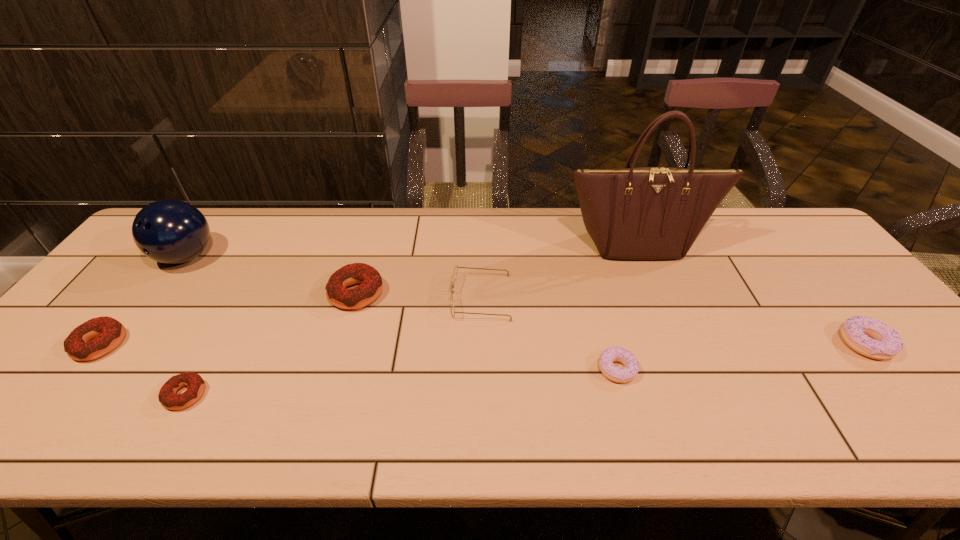
Locate an element on the screen. object at the right edge is located at coordinates pos(857,331).

You are a GUI agent. You are given a task and a screenshot of the screen. Output one action in this format:
    pyautogui.click(x=<x>, y=<y>)
    Task: Click on the object present at the far left corner
    Image resolution: width=960 pixels, height=540 pixels.
    Given the screenshot: What is the action you would take?
    pyautogui.click(x=168, y=231)

Find the location of a particular element. vacant space at the far edge is located at coordinates (571, 217).

Locate an element on the screen. The height and width of the screenshot is (540, 960). free space at the near edge is located at coordinates (655, 436).

You are a GUI agent. You are given a task and a screenshot of the screen. Output one action in this format:
    pyautogui.click(x=<x>, y=<y>)
    Task: Click on the vacant area at the right edge of the desktop
    The image size is (960, 540).
    Given the screenshot: What is the action you would take?
    pyautogui.click(x=804, y=265)

Locate an element on the screen. The image size is (960, 540). vacant space at the far right corner is located at coordinates (762, 237).

Locate an element on the screen. This screenshot has height=540, width=960. vacant area that lies between the rightmost object and the handbag is located at coordinates (751, 294).

Locate an element on the screen. This screenshot has height=540, width=960. empty space between the leftmost chocolate doughnut and the spectacles is located at coordinates (291, 321).

Find the location of a particular element. This screenshot has height=540, width=960. free space between the third object from left to right and the rightmost doughnut is located at coordinates (525, 369).

Locate an element on the screen. unoccupied position between the second chocolate doughnut from right to left and the smaller purple doughnut is located at coordinates [401, 382].